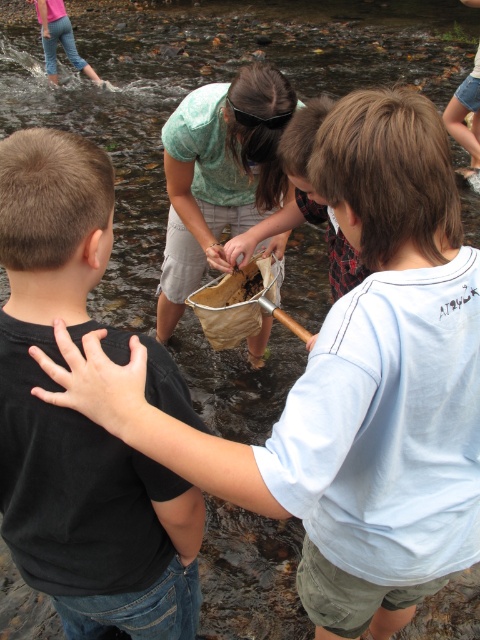
You are a photographer trying to capture a group photo of the children. Given that the black matte shirt at left is narrower than the denim shorts at lower right, which child should you position closer to the center to ensure both are equally visible in the frame?

Since the black matte shirt at left is narrower than the denim shorts at lower right, positioning the child in the black matte shirt at left slightly closer to the center will help balance their visibility in the photo.